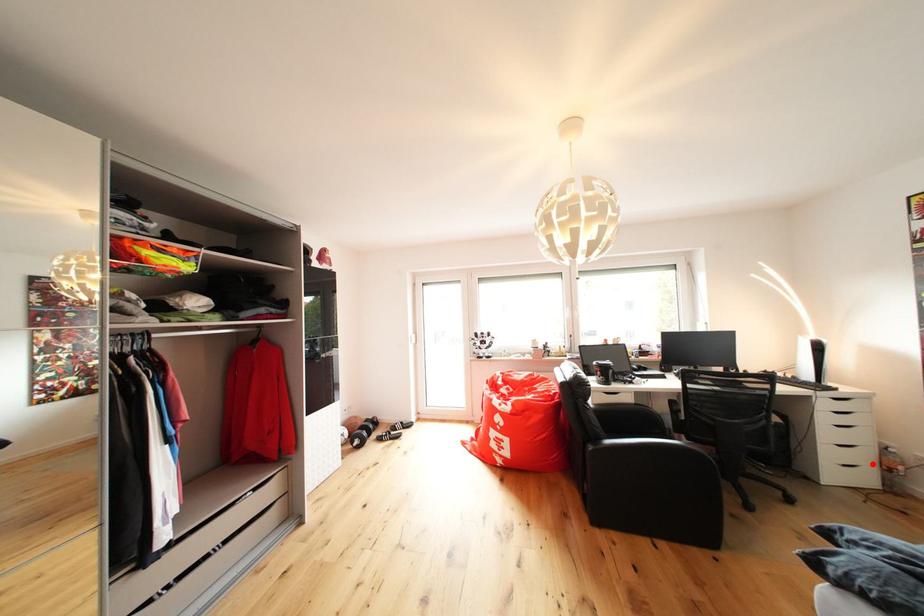
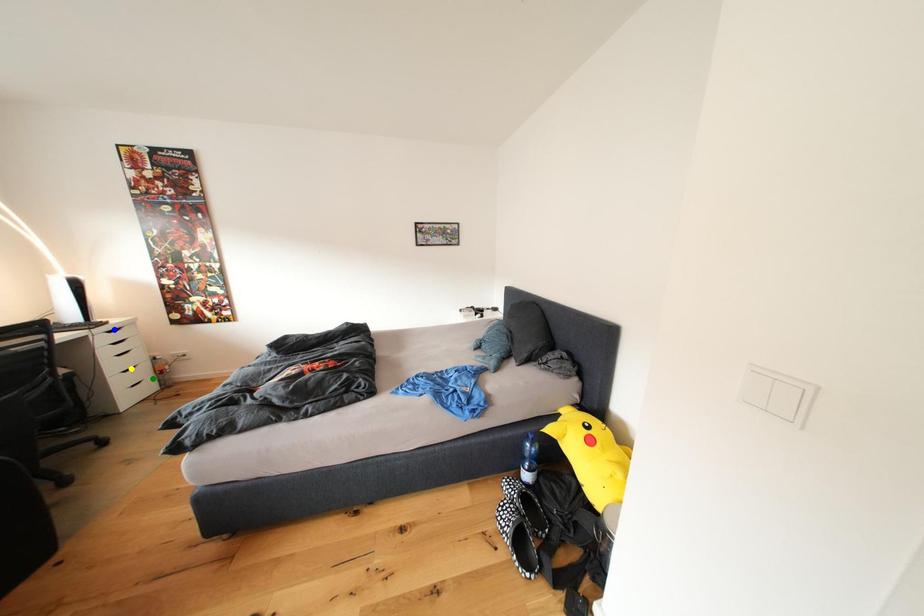
Question: I am providing you with two images of the same scene from different viewpoints. A red point is marked on the first image. You are given multiple points on the second image. Which spot in image 2 lines up with the point in image 1?

Choices:
 (A) green point
 (B) yellow point
 (C) blue point

Answer: (A)